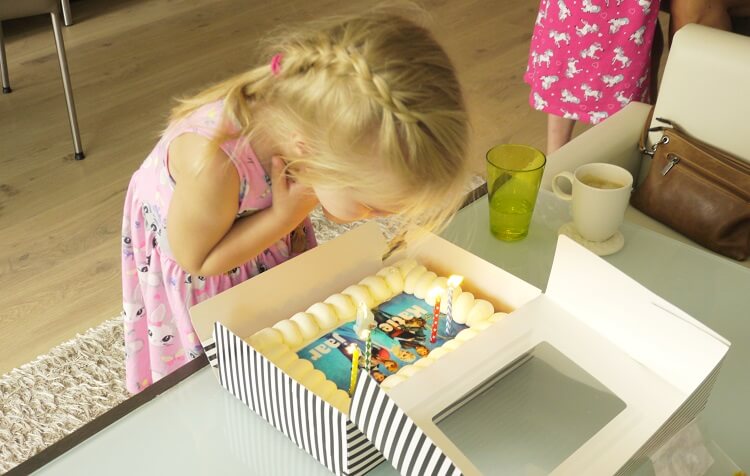
This screenshot has width=750, height=476. Find the location of `table`. table is located at coordinates (225, 450).